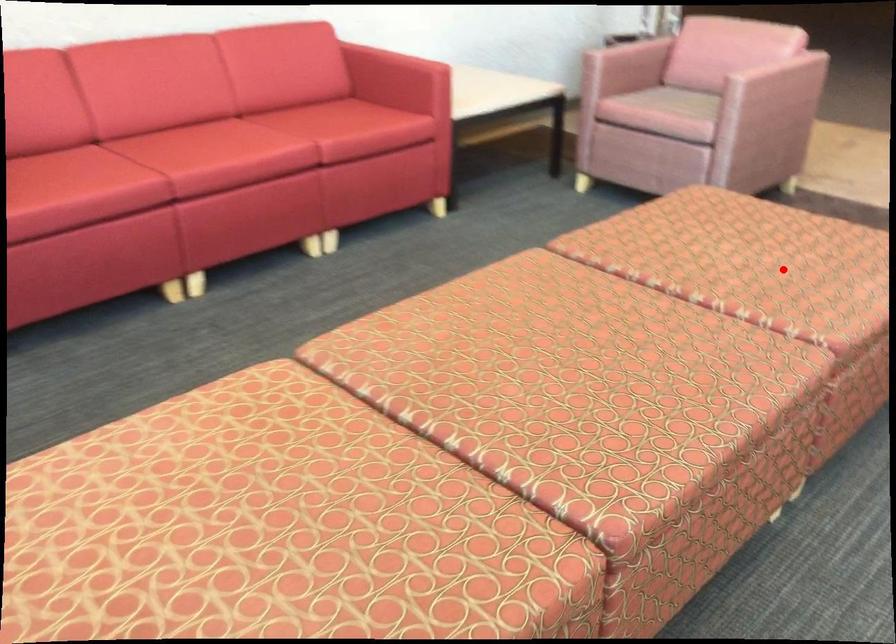
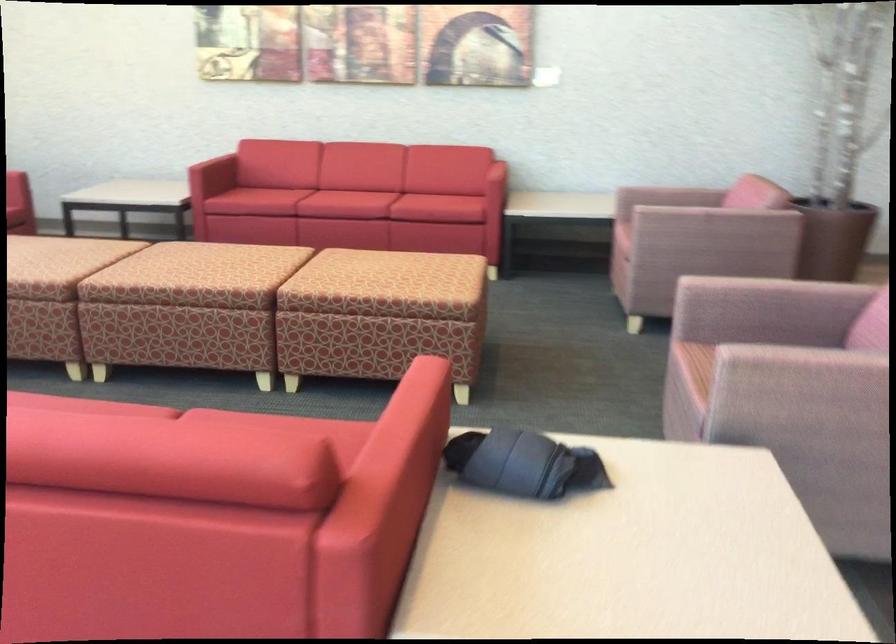
In the second image, find the point that corresponds to the highlighted location in the first image.

(385, 270)